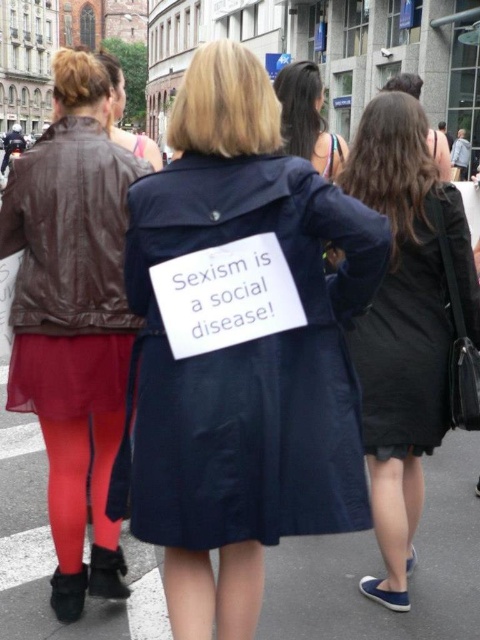
Question: Is dark brown hair at upper center wider than leather jacket at upper left?

Choices:
 (A) no
 (B) yes

Answer: (A)

Question: Based on their relative distances, which object is nearer to the leather jacket at left?

Choices:
 (A) leather jacket at upper left
 (B) navy blue coat at center
 (C) dark brown hair at upper center

Answer: (B)

Question: Can you confirm if black matte dress at right is positioned above leather jacket at upper left?

Choices:
 (A) yes
 (B) no

Answer: (B)

Question: Which is nearer to the dark brown hair at upper center?

Choices:
 (A) leather jacket at upper left
 (B) navy blue coat at center
 (C) leather jacket at left

Answer: (A)

Question: Is navy blue coat at center thinner than dark brown hair at upper center?

Choices:
 (A) yes
 (B) no

Answer: (B)

Question: Which of the following is the farthest from the observer?

Choices:
 (A) navy blue coat at center
 (B) leather jacket at upper left

Answer: (B)